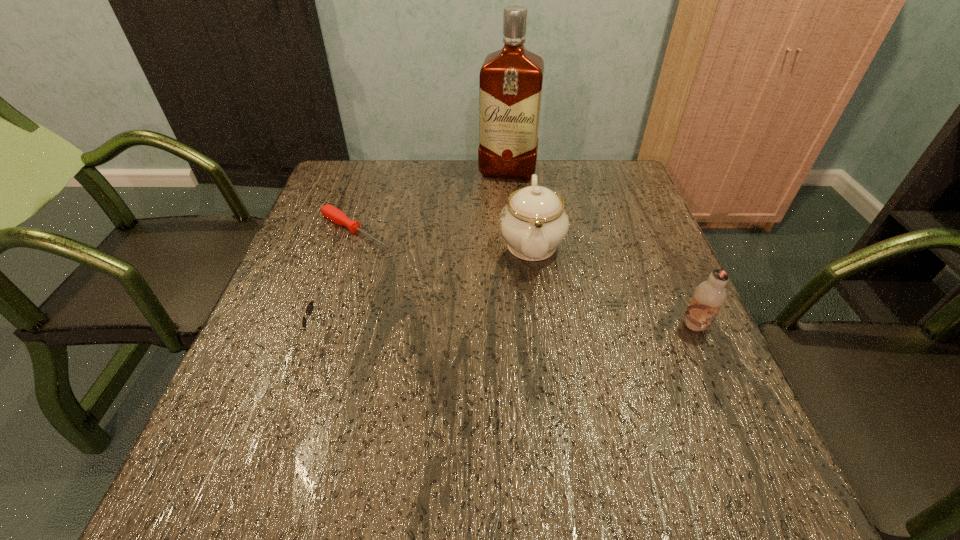
Identify the location of blank region between the fourth tallest object and the chinaware. The height and width of the screenshot is (540, 960). (431, 289).

The height and width of the screenshot is (540, 960). In order to click on free point between the rightmost object and the farthest object in this screenshot , I will do `click(601, 248)`.

Locate an element on the screen. This screenshot has width=960, height=540. vacant area between the chinaware and the shortest object is located at coordinates (444, 238).

Identify the location of vacant space in between the chinaware and the screwdriver. This screenshot has width=960, height=540. (444, 238).

Image resolution: width=960 pixels, height=540 pixels. I want to click on free space between the liquor and the rightmost object, so click(601, 248).

Where is `free area in between the screwdriver and the farthest object`? free area in between the screwdriver and the farthest object is located at coordinates (432, 201).

This screenshot has height=540, width=960. What are the coordinates of `free space between the chinaware and the screwdriver` in the screenshot? It's located at (444, 238).

The image size is (960, 540). I want to click on vacant region between the second shortest object and the rightmost object, so click(513, 330).

Point out which object is positioned as the fourth nearest to the liquor. Please provide its 2D coordinates. Your answer should be formatted as a tuple, i.e. [(x, y)], where the tuple contains the x and y coordinates of a point satisfying the conditions above.

[(709, 296)]

Select which object appears as the closest to the chinaware. Please provide its 2D coordinates. Your answer should be formatted as a tuple, i.e. [(x, y)], where the tuple contains the x and y coordinates of a point satisfying the conditions above.

[(511, 79)]